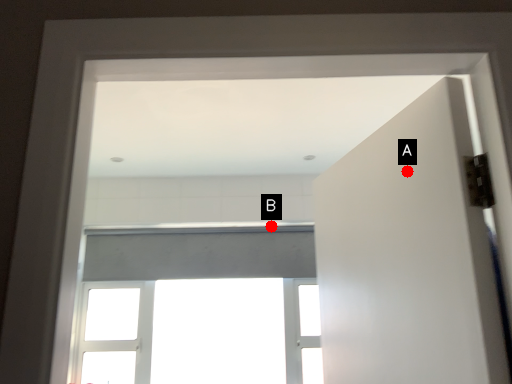
Question: Two points are circled on the image, labeled by A and B beside each circle. Which point is farther to the camera?

Choices:
 (A) A is further
 (B) B is further

Answer: (B)